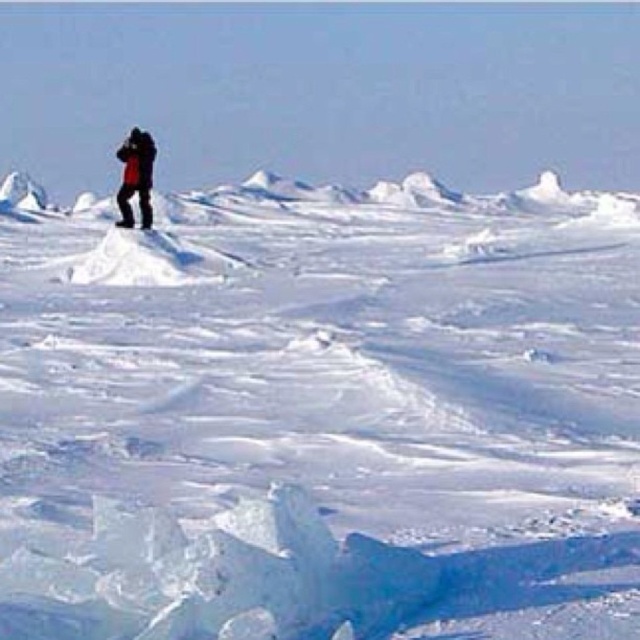
Question: Does white frosty snow at center have a greater width compared to red jacket at upper left?

Choices:
 (A) no
 (B) yes

Answer: (B)

Question: Where is white frosty snow at center located in relation to red jacket at upper left in the image?

Choices:
 (A) right
 (B) left

Answer: (A)

Question: Which of the following is the farthest from the observer?

Choices:
 (A) (17, 600)
 (B) (136, 184)

Answer: (B)

Question: Is white frosty snow at center thinner than red jacket at upper left?

Choices:
 (A) no
 (B) yes

Answer: (A)